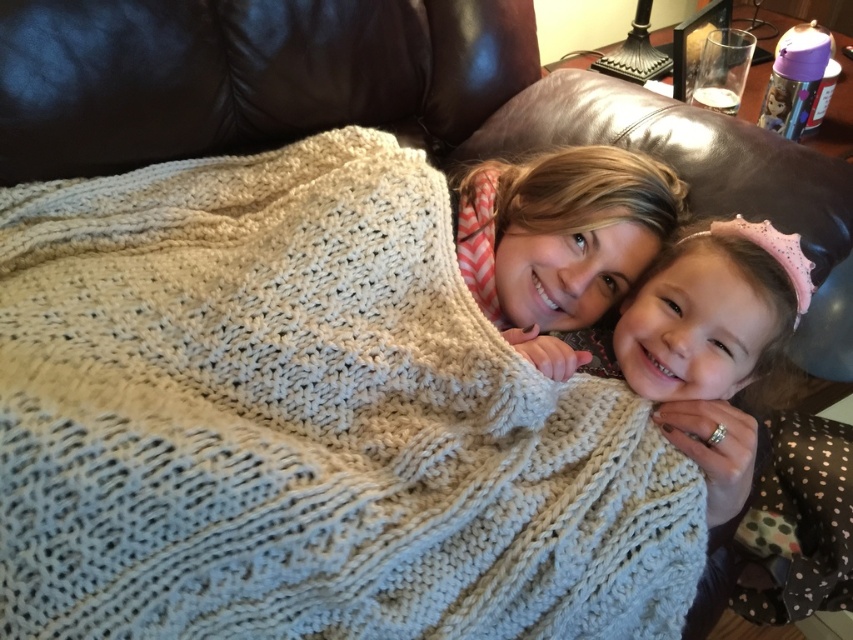
Who is positioned more to the left, knitted wool blanket at center or polka dot dress at center?

Positioned to the left is knitted wool blanket at center.

Is knitted wool blanket at center wider than polka dot dress at center?

Yes, knitted wool blanket at center is wider than polka dot dress at center.

Where is `knitted wool blanket at center`? This screenshot has height=640, width=853. knitted wool blanket at center is located at coordinates (305, 420).

Does polka dot dress at center have a lesser height compared to chevron scarf at center?

No, polka dot dress at center is not shorter than chevron scarf at center.

Between polka dot dress at center and chevron scarf at center, which one appears on the left side from the viewer's perspective?

Positioned to the left is chevron scarf at center.

Which is behind, point (664, 280) or point (558, 225)?

The point (558, 225) is more distant.

You are a GUI agent. You are given a task and a screenshot of the screen. Output one action in this format:
    pyautogui.click(x=<x>, y=<y>)
    Task: Click on the polka dot dress at center
    The height and width of the screenshot is (640, 853).
    Given the screenshot: What is the action you would take?
    pyautogui.click(x=708, y=355)

Does knitted wool blanket at center appear under chevron scarf at center?

Yes.

Does point (425, 196) come farther from viewer compared to point (543, 257)?

Yes, it is behind point (543, 257).

Find the location of a particular element. knitted wool blanket at center is located at coordinates pyautogui.click(x=305, y=420).